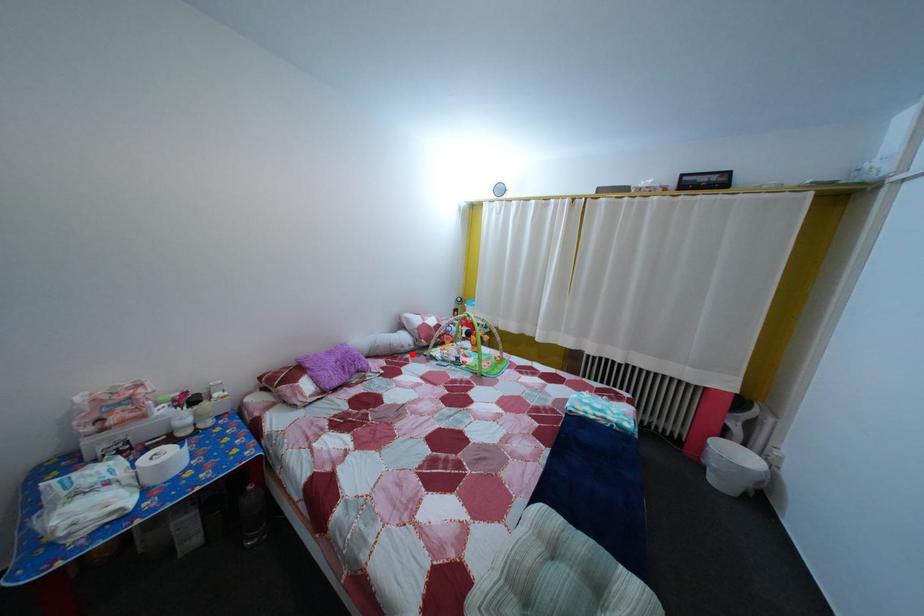
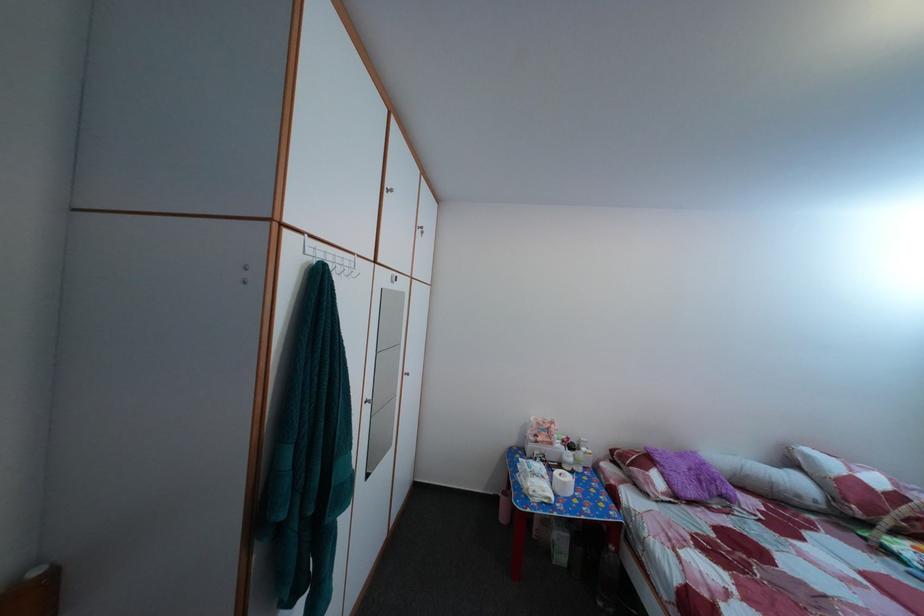
Question: I am providing you with two images of the same scene from different viewpoints. Given a red point in image1, look at the same physical point in image2. Is it:

Choices:
 (A) Closer to the viewpoint
 (B) Farther from the viewpoint

Answer: (A)